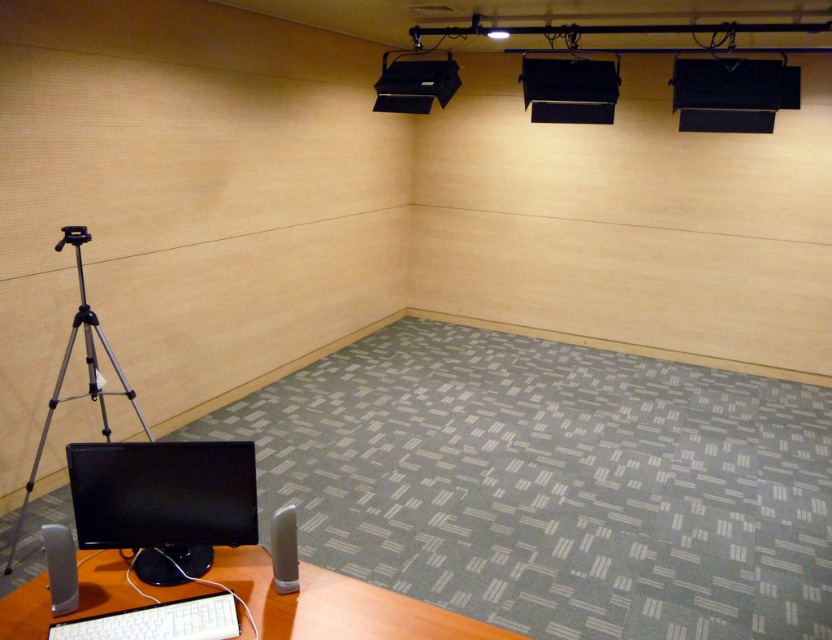
Question: Considering the real-world distances, which object is closest to the black matte projector at upper center?

Choices:
 (A) white glossy speaker at lower center
 (B) silver metallic tripod at left

Answer: (B)

Question: Can you confirm if brown wood computer desk at lower left is positioned to the left of white plastic keyboard at lower center?

Choices:
 (A) no
 (B) yes

Answer: (A)

Question: Which object is the closest to the silver metallic tripod at left?

Choices:
 (A) black matte projector at upper center
 (B) black glossy monitor at lower left
 (C) brown wood computer desk at lower left
 (D) white plastic keyboard at lower center

Answer: (B)

Question: Is brown wood computer desk at lower left smaller than gray matte speaker at lower left?

Choices:
 (A) no
 (B) yes

Answer: (A)

Question: Which object is the closest to the black glossy monitor at lower left?

Choices:
 (A) silver metallic tripod at left
 (B) gray matte speaker at lower left

Answer: (B)

Question: Can you confirm if brown wood computer desk at lower left is positioned above white glossy speaker at lower center?

Choices:
 (A) no
 (B) yes

Answer: (A)